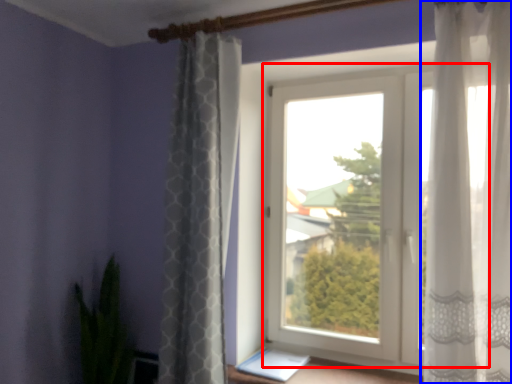
Question: Among these objects, which one is nearest to the camera, window (highlighted by a red box) or curtain (highlighted by a blue box)?

Choices:
 (A) window
 (B) curtain

Answer: (B)